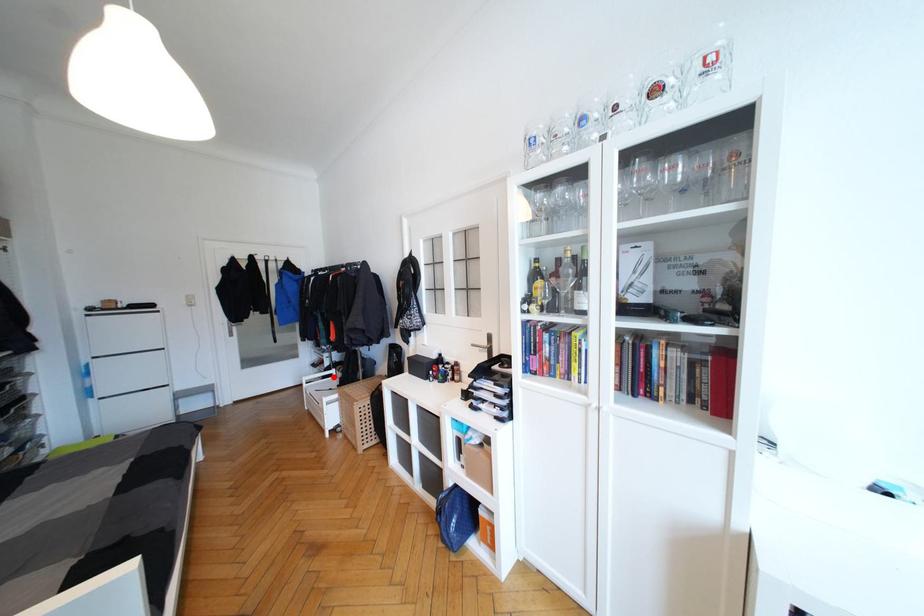
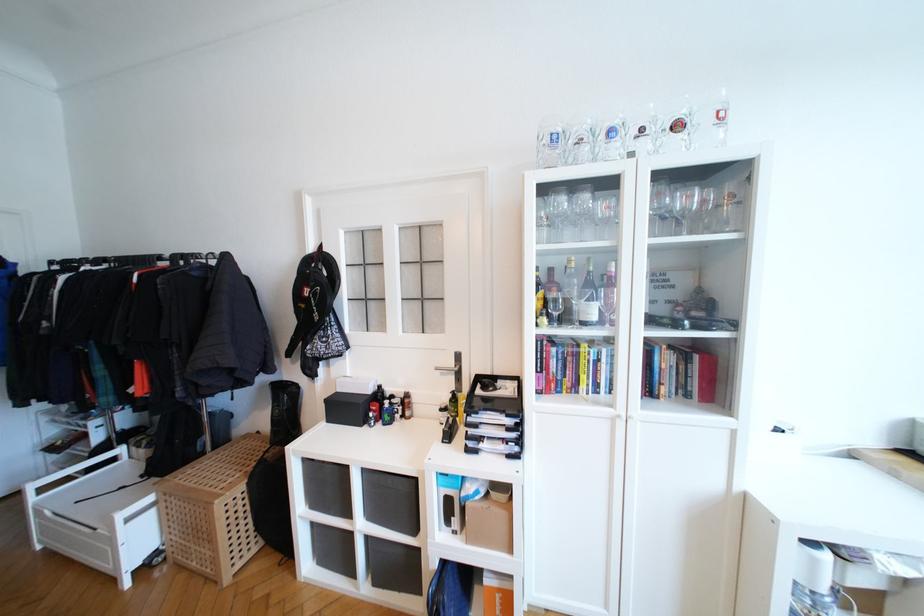
In the second image, find the point that corresponds to the highlighted location in the first image.

(116, 461)